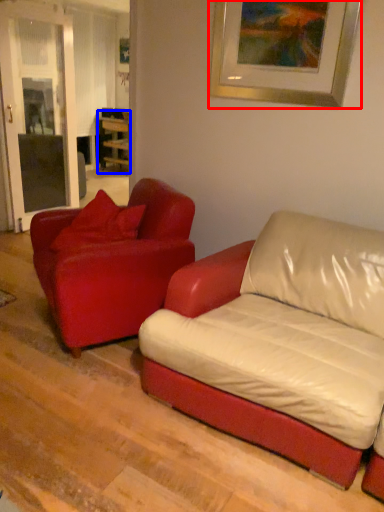
Question: Among these objects, which one is nearest to the camera, picture frame (highlighted by a red box) or table (highlighted by a blue box)?

Choices:
 (A) picture frame
 (B) table

Answer: (A)